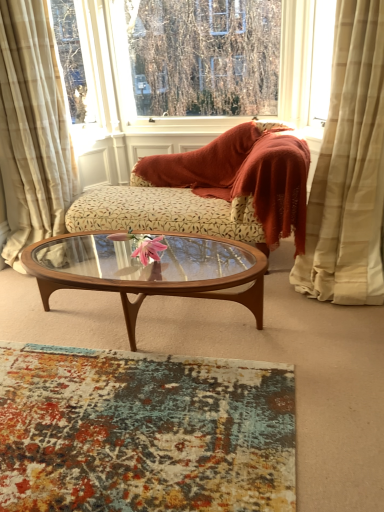
Image resolution: width=384 pixels, height=512 pixels. Find the location of `floral-patterned fabric couch at center`. floral-patterned fabric couch at center is located at coordinates (213, 190).

The height and width of the screenshot is (512, 384). Describe the element at coordinates (349, 169) in the screenshot. I see `beige textured curtain at right, which is the 1th curtain in right-to-left order` at that location.

Locate an element on the screen. floral-patterned fabric couch at center is located at coordinates (213, 190).

Considering the sizes of objects floral-patterned fabric couch at center and beige plaid curtain at left, the 1th curtain positioned from the left, in the image provided, who is bigger, floral-patterned fabric couch at center or beige plaid curtain at left, the 1th curtain positioned from the left,?

With larger size is beige plaid curtain at left, the 1th curtain positioned from the left.

Is floral-patterned fabric couch at center next to beige plaid curtain at left, the 1th curtain positioned from the left?

There is a gap between floral-patterned fabric couch at center and beige plaid curtain at left, the 1th curtain positioned from the left.

From the image's perspective, is floral-patterned fabric couch at center above or below beige plaid curtain at left, the second curtain viewed from the right?

floral-patterned fabric couch at center is below beige plaid curtain at left, the second curtain viewed from the right.

From the image's perspective, count 2nd curtains upward from the floral-patterned fabric couch at center and point to it. Please provide its 2D coordinates.

[(33, 128)]

Considering the sizes of objects floral-patterned fabric couch at center and beige textured curtain at right, arranged as the 2th curtain when viewed from the left, in the image provided, who is thinner, floral-patterned fabric couch at center or beige textured curtain at right, arranged as the 2th curtain when viewed from the left,?

floral-patterned fabric couch at center.

In the image, is floral-patterned fabric couch at center on the left side or the right side of beige textured curtain at right, which is the 1th curtain in right-to-left order?

In the image, floral-patterned fabric couch at center appears on the left side of beige textured curtain at right, which is the 1th curtain in right-to-left order.

Looking at this image, from the image's perspective, is floral-patterned fabric couch at center over beige textured curtain at right, arranged as the 2th curtain when viewed from the left?

No, from the image's perspective, floral-patterned fabric couch at center is not above beige textured curtain at right, arranged as the 2th curtain when viewed from the left.

Relative to beige textured curtain at right, which is the 1th curtain in right-to-left order, is floral-patterned fabric couch at center in front or behind?

Visually, floral-patterned fabric couch at center is located behind beige textured curtain at right, which is the 1th curtain in right-to-left order.

In terms of height, does wooden glass coffee table at center look taller or shorter compared to transparent glass window at upper center?

Considering their sizes, wooden glass coffee table at center has less height than transparent glass window at upper center.

Is wooden glass coffee table at center positioned behind transparent glass window at upper center?

No, it is not.

Does wooden glass coffee table at center have a larger size compared to transparent glass window at upper center?

No, wooden glass coffee table at center is not bigger than transparent glass window at upper center.

Does wooden glass coffee table at center contain transparent glass window at upper center?

No, transparent glass window at upper center is not inside wooden glass coffee table at center.

Consider the image. How many degrees apart are the facing directions of wooden glass coffee table at center and beige textured curtain at right, arranged as the 2th curtain when viewed from the left?

The angle between the facing direction of wooden glass coffee table at center and the facing direction of beige textured curtain at right, arranged as the 2th curtain when viewed from the left, is 3.05 degrees.

From the image's perspective, does wooden glass coffee table at center appear higher than beige textured curtain at right, arranged as the 2th curtain when viewed from the left?

No.

Is beige textured curtain at right, arranged as the 2th curtain when viewed from the left, at the back of wooden glass coffee table at center?

No, wooden glass coffee table at center's orientation is not away from beige textured curtain at right, arranged as the 2th curtain when viewed from the left.

Does point (174, 285) appear closer or farther from the camera than point (382, 56)?

Clearly, point (174, 285) is closer to the camera than point (382, 56).

Is beige plaid curtain at left, the second curtain viewed from the right, not inside wooden glass coffee table at center?

beige plaid curtain at left, the second curtain viewed from the right, lies outside wooden glass coffee table at center's area.

From a real-world perspective, is beige plaid curtain at left, the 1th curtain positioned from the left, located beneath wooden glass coffee table at center?

No, from a real-world perspective, beige plaid curtain at left, the 1th curtain positioned from the left, is not below wooden glass coffee table at center.

Is beige plaid curtain at left, the 1th curtain positioned from the left, positioned far away from wooden glass coffee table at center?

Actually, beige plaid curtain at left, the 1th curtain positioned from the left, and wooden glass coffee table at center are a little close together.

Which object is positioned more to the right, transparent glass window at upper center or beige textured curtain at right, which is the 1th curtain in right-to-left order?

beige textured curtain at right, which is the 1th curtain in right-to-left order.

In the image, there is a beige textured curtain at right, arranged as the 2th curtain when viewed from the left. Where is `window above it (from the image's perspective)`? The height and width of the screenshot is (512, 384). window above it (from the image's perspective) is located at coordinates (192, 67).

From the picture: Is transparent glass window at upper center oriented away from beige textured curtain at right, arranged as the 2th curtain when viewed from the left?

No, beige textured curtain at right, arranged as the 2th curtain when viewed from the left, is not at the back of transparent glass window at upper center.

Based on the photo, between transparent glass window at upper center and beige textured curtain at right, arranged as the 2th curtain when viewed from the left, which one has smaller size?

transparent glass window at upper center.

Between wooden glass coffee table at center and beige plaid curtain at left, the 1th curtain positioned from the left, which one has larger size?

With larger size is beige plaid curtain at left, the 1th curtain positioned from the left.

Is wooden glass coffee table at center facing towards beige plaid curtain at left, the second curtain viewed from the right?

No, wooden glass coffee table at center does not turn towards beige plaid curtain at left, the second curtain viewed from the right.

Relative to beige plaid curtain at left, the 1th curtain positioned from the left, is wooden glass coffee table at center in front or behind?

In the image, wooden glass coffee table at center appears in front of beige plaid curtain at left, the 1th curtain positioned from the left.

Is wooden glass coffee table at center situated inside beige plaid curtain at left, the 1th curtain positioned from the left, or outside?

wooden glass coffee table at center exists outside the volume of beige plaid curtain at left, the 1th curtain positioned from the left.

Image resolution: width=384 pixels, height=512 pixels. What are the coordinates of `the 1st curtain directly above the floral-patterned fabric couch at center (from a real-world perspective)` in the screenshot? It's located at (33, 128).

Find the location of a particular element. Image resolution: width=384 pixels, height=512 pixels. studio couch behind the beige textured curtain at right, which is the 1th curtain in right-to-left order is located at coordinates (213, 190).

Estimate the real-world distances between objects in this image. Which object is closer to floral-patterned fabric couch at center, wooden glass coffee table at center or beige plaid curtain at left, the second curtain viewed from the right?

Based on the image, wooden glass coffee table at center appears to be nearer to floral-patterned fabric couch at center.

From the picture: Estimate the real-world distances between objects in this image. Which object is closer to transparent glass window at upper center, wooden glass coffee table at center or beige textured curtain at right, arranged as the 2th curtain when viewed from the left?

The object closer to transparent glass window at upper center is beige textured curtain at right, arranged as the 2th curtain when viewed from the left.

From the picture: Considering their positions, is beige plaid curtain at left, the 1th curtain positioned from the left, positioned further to wooden glass coffee table at center than transparent glass window at upper center?

transparent glass window at upper center is positioned further to the anchor wooden glass coffee table at center.

Based on their spatial positions, is beige textured curtain at right, arranged as the 2th curtain when viewed from the left, or beige plaid curtain at left, the second curtain viewed from the right, closer to wooden glass coffee table at center?

beige plaid curtain at left, the second curtain viewed from the right, lies closer to wooden glass coffee table at center than the other object.

In the scene shown: Considering their positions, is transparent glass window at upper center positioned further to floral-patterned fabric couch at center than beige plaid curtain at left, the second curtain viewed from the right?

beige plaid curtain at left, the second curtain viewed from the right.

Consider the image. When comparing their distances from floral-patterned fabric couch at center, does beige plaid curtain at left, the 1th curtain positioned from the left, or wooden glass coffee table at center seem closer?

wooden glass coffee table at center lies closer to floral-patterned fabric couch at center than the other object.

From the image, which object appears to be farther from wooden glass coffee table at center, floral-patterned fabric couch at center or transparent glass window at upper center?

transparent glass window at upper center is further to wooden glass coffee table at center.

From the image, which object appears to be nearer to beige plaid curtain at left, the 1th curtain positioned from the left, wooden glass coffee table at center or beige textured curtain at right, which is the 1th curtain in right-to-left order?

The object closer to beige plaid curtain at left, the 1th curtain positioned from the left, is wooden glass coffee table at center.

Where is `coffee table situated between beige plaid curtain at left, the second curtain viewed from the right, and beige textured curtain at right, arranged as the 2th curtain when viewed from the left, from left to right`? The height and width of the screenshot is (512, 384). coffee table situated between beige plaid curtain at left, the second curtain viewed from the right, and beige textured curtain at right, arranged as the 2th curtain when viewed from the left, from left to right is located at coordinates pyautogui.click(x=150, y=271).

The height and width of the screenshot is (512, 384). Find the location of `studio couch situated between wooden glass coffee table at center and beige textured curtain at right, which is the 1th curtain in right-to-left order, from left to right`. studio couch situated between wooden glass coffee table at center and beige textured curtain at right, which is the 1th curtain in right-to-left order, from left to right is located at coordinates (213, 190).

Where is `studio couch between beige plaid curtain at left, the second curtain viewed from the right, and beige textured curtain at right, arranged as the 2th curtain when viewed from the left`? The height and width of the screenshot is (512, 384). studio couch between beige plaid curtain at left, the second curtain viewed from the right, and beige textured curtain at right, arranged as the 2th curtain when viewed from the left is located at coordinates (213, 190).

Where is `coffee table between beige plaid curtain at left, the 1th curtain positioned from the left, and floral-patterned fabric couch at center`? Image resolution: width=384 pixels, height=512 pixels. coffee table between beige plaid curtain at left, the 1th curtain positioned from the left, and floral-patterned fabric couch at center is located at coordinates (150, 271).